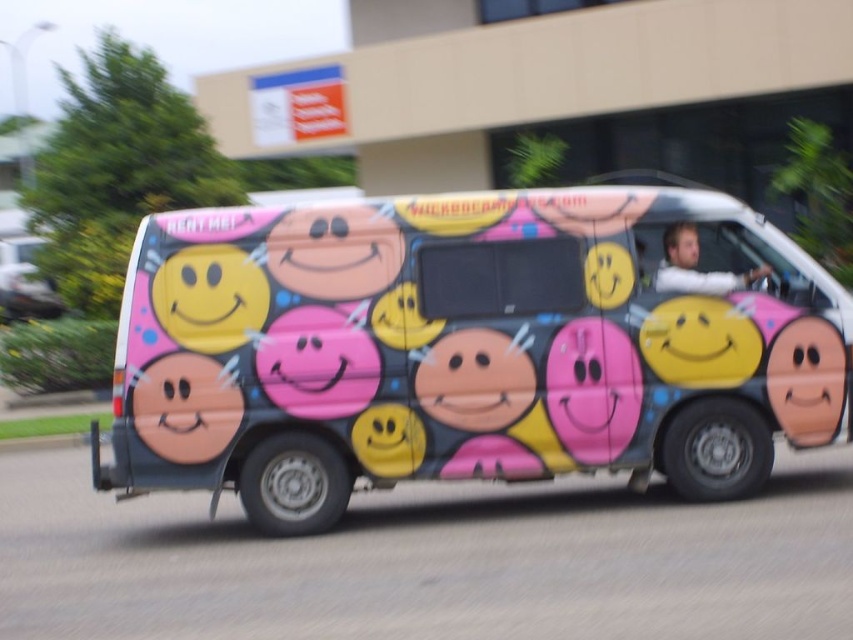
Between matte painted van at center and matte pink smiley face at center, which one is positioned higher?

Positioned higher is matte painted van at center.

This screenshot has width=853, height=640. Identify the location of matte painted van at center. (479, 346).

Does matte pink smiley face at center have a larger size compared to matte skin face at center?

Yes, matte pink smiley face at center is bigger than matte skin face at center.

The width and height of the screenshot is (853, 640). I want to click on matte pink smiley face at center, so click(184, 406).

What are the coordinates of `matte pink smiley face at center` in the screenshot? It's located at point(184,406).

Where is `matte painted van at center`? The width and height of the screenshot is (853, 640). matte painted van at center is located at coordinates (479, 346).

Is matte painted van at center in front of matte skin face at center?

That is True.

This screenshot has height=640, width=853. I want to click on matte painted van at center, so click(479, 346).

What are the coordinates of `matte painted van at center` in the screenshot? It's located at (479, 346).